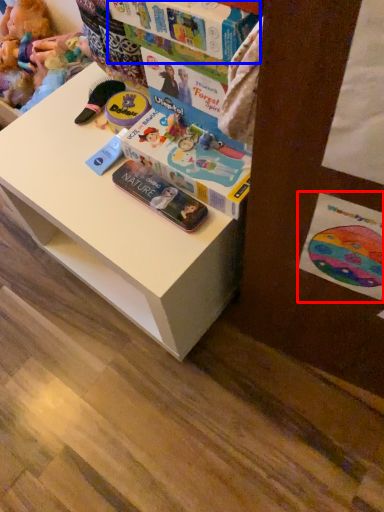
Question: Among these objects, which one is farthest to the camera, postcard (highlighted by a red box) or book (highlighted by a blue box)?

Choices:
 (A) postcard
 (B) book

Answer: (B)